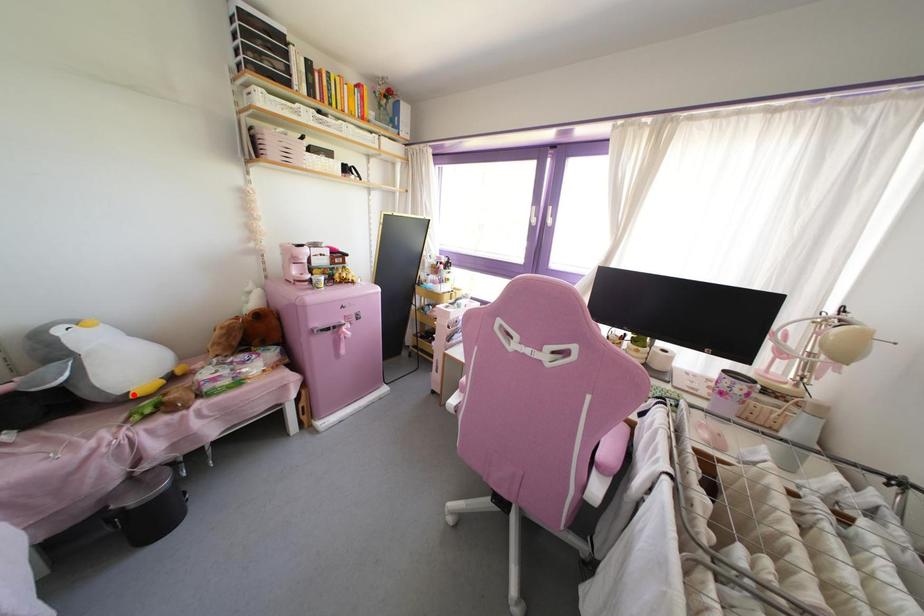
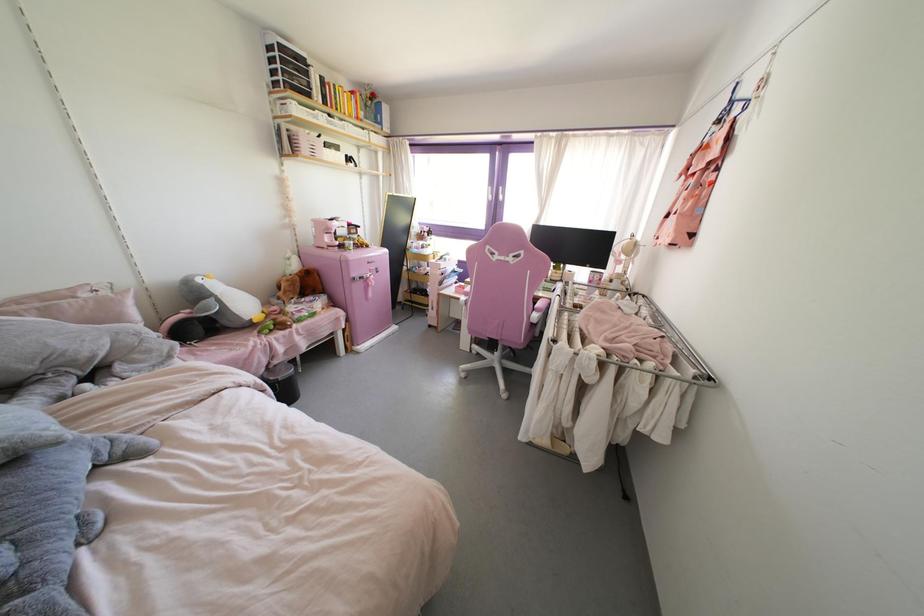
Locate, in the second image, the point that corresponds to the highlighted location in the first image.

(254, 320)